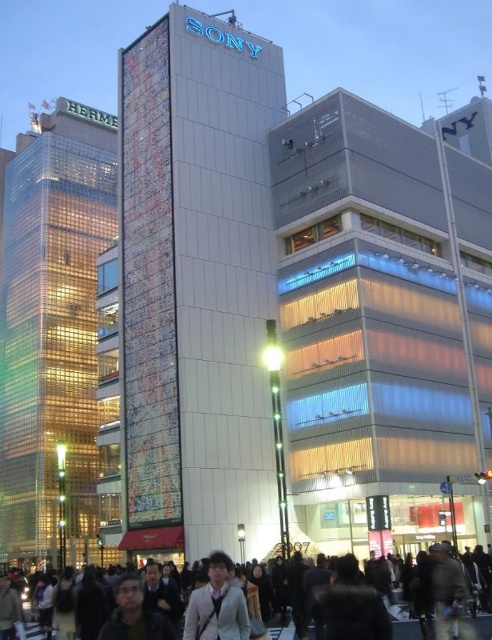
Is light brown leather jacket at center to the left of dark clothing crowd at center from the viewer's perspective?

In fact, light brown leather jacket at center is to the right of dark clothing crowd at center.

Consider the image. Between light brown leather jacket at center and dark clothing crowd at center, which one appears on the right side from the viewer's perspective?

Positioned to the right is light brown leather jacket at center.

The height and width of the screenshot is (640, 492). Describe the element at coordinates (216, 605) in the screenshot. I see `light brown leather jacket at center` at that location.

Locate an element on the screen. The width and height of the screenshot is (492, 640). light brown leather jacket at center is located at coordinates (216, 605).